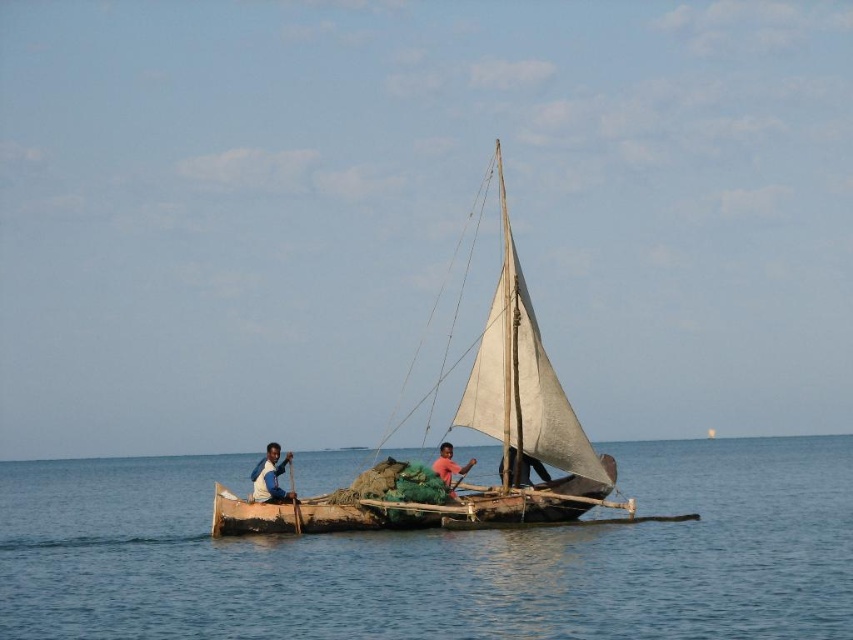
You are standing on the deck of the boat and want to jump into the clear blue water at center. The safety rule states that you must be at least 30 meters away from the boat to dive safely. Can you jump in from your current position?

The clear blue water at center is 39.55 meters away from viewer, which is more than the required 30 meters. Therefore, you can safely jump in from your current position.

You are standing on the deck of the boat and notice two points marked on the water surface. The first point is at coordinate point (842, 440) and the second is at point (515, 481). From your vantage point on the boat, which point is closer to the stern?

Point (842, 440) is behind point (515, 481), so the point closer to the stern would be point (842, 440).

You are a sailor trying to determine if there is enough space to store a large fishing net on the boat. Based on the image, which object takes up more space, the dark blue fabric sail at center or the dark skin human at center?

The dark blue fabric sail at center occupies less space than dark skin human at center, so the human takes up more space. Therefore, storing a large fishing net might be challenging due to limited space.